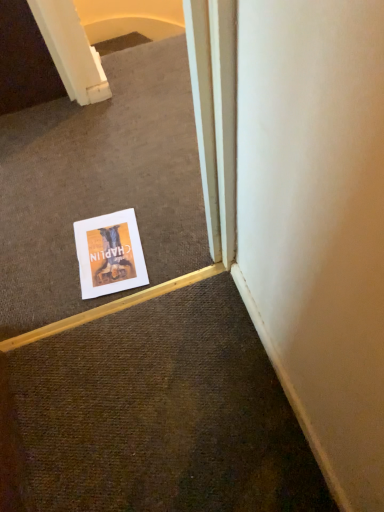
Question: From the image's perspective, is white paper poster at center above or below white paper at center?

Choices:
 (A) below
 (B) above

Answer: (A)

Question: From a real-world perspective, relative to white paper at center, is white paper poster at center vertically above or below?

Choices:
 (A) above
 (B) below

Answer: (B)

Question: Is white paper poster at center wider or thinner than white paper at center?

Choices:
 (A) wide
 (B) thin

Answer: (B)

Question: From the image's perspective, is white paper at center positioned above or below white paper poster at center?

Choices:
 (A) above
 (B) below

Answer: (A)

Question: Is point (157, 174) closer or farther from the camera than point (107, 247)?

Choices:
 (A) closer
 (B) farther

Answer: (B)

Question: Considering the positions of white paper at center and white paper poster at center in the image, is white paper at center bigger or smaller than white paper poster at center?

Choices:
 (A) big
 (B) small

Answer: (A)

Question: Is white paper at center spatially inside white paper poster at center, or outside of it?

Choices:
 (A) outside
 (B) inside

Answer: (A)